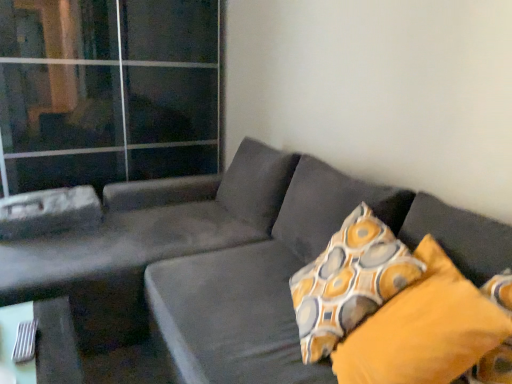
Locate an element on the screen. This screenshot has height=384, width=512. velvet dark gray couch at center is located at coordinates (204, 268).

What are the coordinates of `patterned fabric pillow at right, which is counted as the 1th pillow, starting from the back` in the screenshot? It's located at (349, 282).

The height and width of the screenshot is (384, 512). Describe the element at coordinates (349, 282) in the screenshot. I see `patterned fabric pillow at right, placed as the 2th pillow when sorted from front to back` at that location.

I want to click on yellow fabric pillow at right, marked as the 2th pillow in a back-to-front arrangement, so click(424, 329).

Looking at this image, is velvet dark gray couch at center inside the boundaries of patterned fabric pillow at right, which is counted as the 1th pillow, starting from the back, or outside?

velvet dark gray couch at center is not enclosed by patterned fabric pillow at right, which is counted as the 1th pillow, starting from the back.

Is velvet dark gray couch at center in front of or behind patterned fabric pillow at right, which is counted as the 1th pillow, starting from the back, in the image?

velvet dark gray couch at center is in front of patterned fabric pillow at right, which is counted as the 1th pillow, starting from the back.

Measure the distance from velvet dark gray couch at center to patterned fabric pillow at right, placed as the 2th pillow when sorted from front to back.

velvet dark gray couch at center and patterned fabric pillow at right, placed as the 2th pillow when sorted from front to back, are 44.02 centimeters apart from each other.

Is velvet dark gray couch at center with patterned fabric pillow at right, placed as the 2th pillow when sorted from front to back?

No, velvet dark gray couch at center is not with patterned fabric pillow at right, placed as the 2th pillow when sorted from front to back.

Considering the positions of objects yellow fabric pillow at right, which is the 1th pillow from front to back, and patterned fabric pillow at right, placed as the 2th pillow when sorted from front to back, in the image provided, who is in front, yellow fabric pillow at right, which is the 1th pillow from front to back, or patterned fabric pillow at right, placed as the 2th pillow when sorted from front to back,?

yellow fabric pillow at right, which is the 1th pillow from front to back, is more forward.

Can you confirm if yellow fabric pillow at right, which is the 1th pillow from front to back, is positioned to the left of patterned fabric pillow at right, which is counted as the 1th pillow, starting from the back?

Incorrect, yellow fabric pillow at right, which is the 1th pillow from front to back, is not on the left side of patterned fabric pillow at right, which is counted as the 1th pillow, starting from the back.

Considering the sizes of objects yellow fabric pillow at right, which is the 1th pillow from front to back, and patterned fabric pillow at right, which is counted as the 1th pillow, starting from the back, in the image provided, who is wider, yellow fabric pillow at right, which is the 1th pillow from front to back, or patterned fabric pillow at right, which is counted as the 1th pillow, starting from the back,?

Wider between the two is yellow fabric pillow at right, which is the 1th pillow from front to back.

Is yellow fabric pillow at right, which is the 1th pillow from front to back, shorter than patterned fabric pillow at right, which is counted as the 1th pillow, starting from the back?

Indeed, yellow fabric pillow at right, which is the 1th pillow from front to back, has a lesser height compared to patterned fabric pillow at right, which is counted as the 1th pillow, starting from the back.

In the scene shown: Is transparent glass door at upper left beside velvet dark gray couch at center?

There is a gap between transparent glass door at upper left and velvet dark gray couch at center.

Does transparent glass door at upper left lie behind velvet dark gray couch at center?

That is True.

From the image's perspective, is transparent glass door at upper left above velvet dark gray couch at center?

Yes, from the image's perspective, transparent glass door at upper left is over velvet dark gray couch at center.

Who is taller, transparent glass door at upper left or velvet dark gray couch at center?

transparent glass door at upper left.

Which object is wider, patterned fabric pillow at right, placed as the 2th pillow when sorted from front to back, or velvet dark gray couch at center?

With larger width is velvet dark gray couch at center.

From the image's perspective, is patterned fabric pillow at right, placed as the 2th pillow when sorted from front to back, beneath velvet dark gray couch at center?

No.

Which object is positioned more to the left, patterned fabric pillow at right, placed as the 2th pillow when sorted from front to back, or velvet dark gray couch at center?

Positioned to the left is velvet dark gray couch at center.

From a real-world perspective, is patterned fabric pillow at right, which is counted as the 1th pillow, starting from the back, positioned above or below velvet dark gray couch at center?

patterned fabric pillow at right, which is counted as the 1th pillow, starting from the back, is situated higher than velvet dark gray couch at center in the real world.

Which object is closer to the camera taking this photo, yellow fabric pillow at right, marked as the 2th pillow in a back-to-front arrangement, or velvet dark gray couch at center?

velvet dark gray couch at center.

This screenshot has width=512, height=384. In the image, there is a velvet dark gray couch at center. In order to click on pillow below it (from the image's perspective) in this screenshot , I will do `click(424, 329)`.

Considering the sizes of objects yellow fabric pillow at right, which is the 1th pillow from front to back, and velvet dark gray couch at center in the image provided, who is bigger, yellow fabric pillow at right, which is the 1th pillow from front to back, or velvet dark gray couch at center?

Bigger between the two is velvet dark gray couch at center.

Could velvet dark gray couch at center be considered to be inside yellow fabric pillow at right, marked as the 2th pillow in a back-to-front arrangement?

No, velvet dark gray couch at center is not a part of yellow fabric pillow at right, marked as the 2th pillow in a back-to-front arrangement.

How far apart are patterned fabric pillow at right, placed as the 2th pillow when sorted from front to back, and transparent glass door at upper left?

patterned fabric pillow at right, placed as the 2th pillow when sorted from front to back, is 2.08 meters away from transparent glass door at upper left.

How different are the orientations of patterned fabric pillow at right, which is counted as the 1th pillow, starting from the back, and transparent glass door at upper left in degrees?

The angle between the facing direction of patterned fabric pillow at right, which is counted as the 1th pillow, starting from the back, and the facing direction of transparent glass door at upper left is 121 degrees.

Looking at the image, does patterned fabric pillow at right, which is counted as the 1th pillow, starting from the back, seem bigger or smaller compared to transparent glass door at upper left?

patterned fabric pillow at right, which is counted as the 1th pillow, starting from the back, is smaller than transparent glass door at upper left.

Who is taller, patterned fabric pillow at right, placed as the 2th pillow when sorted from front to back, or transparent glass door at upper left?

transparent glass door at upper left.

Consider the image. Can you see yellow fabric pillow at right, which is the 1th pillow from front to back, touching transparent glass door at upper left?

There is a gap between yellow fabric pillow at right, which is the 1th pillow from front to back, and transparent glass door at upper left.

From a real-world perspective, starting from the transparent glass door at upper left, which pillow is the 1st one below it? Please provide its 2D coordinates.

[(424, 329)]

Is the depth of yellow fabric pillow at right, marked as the 2th pillow in a back-to-front arrangement, less than that of transparent glass door at upper left?

Yes, it is.

You are a GUI agent. You are given a task and a screenshot of the screen. Output one action in this format:
    pyautogui.click(x=<x>, y=<y>)
    Task: Click on the studio couch located below the patterned fabric pillow at right, placed as the 2th pillow when sorted from front to back (from the image's perspective)
    
    Given the screenshot: What is the action you would take?
    pyautogui.click(x=204, y=268)

Where is `pillow above the patterned fabric pillow at right, placed as the 2th pillow when sorted from front to back (from a real-world perspective)`? Image resolution: width=512 pixels, height=384 pixels. pillow above the patterned fabric pillow at right, placed as the 2th pillow when sorted from front to back (from a real-world perspective) is located at coordinates (424, 329).

Looking at the image, which one is located closer to patterned fabric pillow at right, placed as the 2th pillow when sorted from front to back, yellow fabric pillow at right, which is the 1th pillow from front to back, or transparent glass door at upper left?

Based on the image, yellow fabric pillow at right, which is the 1th pillow from front to back, appears to be nearer to patterned fabric pillow at right, placed as the 2th pillow when sorted from front to back.

When comparing their distances from yellow fabric pillow at right, which is the 1th pillow from front to back, does transparent glass door at upper left or patterned fabric pillow at right, placed as the 2th pillow when sorted from front to back, seem further?

transparent glass door at upper left is positioned further to the anchor yellow fabric pillow at right, which is the 1th pillow from front to back.

Which object lies further to the anchor point patterned fabric pillow at right, placed as the 2th pillow when sorted from front to back, velvet dark gray couch at center or transparent glass door at upper left?

Among the two, transparent glass door at upper left is located further to patterned fabric pillow at right, placed as the 2th pillow when sorted from front to back.

Considering their positions, is transparent glass door at upper left positioned closer to velvet dark gray couch at center than yellow fabric pillow at right, marked as the 2th pillow in a back-to-front arrangement?

yellow fabric pillow at right, marked as the 2th pillow in a back-to-front arrangement, is positioned closer to the anchor velvet dark gray couch at center.

Based on the photo, considering their positions, is yellow fabric pillow at right, marked as the 2th pillow in a back-to-front arrangement, positioned closer to transparent glass door at upper left than patterned fabric pillow at right, placed as the 2th pillow when sorted from front to back?

Based on the image, patterned fabric pillow at right, placed as the 2th pillow when sorted from front to back, appears to be nearer to transparent glass door at upper left.

Which object lies further to the anchor point patterned fabric pillow at right, placed as the 2th pillow when sorted from front to back, velvet dark gray couch at center or yellow fabric pillow at right, marked as the 2th pillow in a back-to-front arrangement?

Based on the image, velvet dark gray couch at center appears to be further to patterned fabric pillow at right, placed as the 2th pillow when sorted from front to back.

Looking at the image, which one is located further to transparent glass door at upper left, patterned fabric pillow at right, which is counted as the 1th pillow, starting from the back, or yellow fabric pillow at right, which is the 1th pillow from front to back?

yellow fabric pillow at right, which is the 1th pillow from front to back, is positioned further to the anchor transparent glass door at upper left.

When comparing their distances from transparent glass door at upper left, does velvet dark gray couch at center or patterned fabric pillow at right, placed as the 2th pillow when sorted from front to back, seem closer?

Among the two, velvet dark gray couch at center is located nearer to transparent glass door at upper left.

At what (x,y) coordinates should I click in order to perform the action: click on pillow located between yellow fabric pillow at right, marked as the 2th pillow in a back-to-front arrangement, and transparent glass door at upper left in the depth direction. Please return your answer as a coordinate pair (x, y). Looking at the image, I should click on (349, 282).

You are a GUI agent. You are given a task and a screenshot of the screen. Output one action in this format:
    pyautogui.click(x=<x>, y=<y>)
    Task: Click on the pillow positioned between velvet dark gray couch at center and patterned fabric pillow at right, placed as the 2th pillow when sorted from front to back, from near to far
    
    Given the screenshot: What is the action you would take?
    pyautogui.click(x=424, y=329)